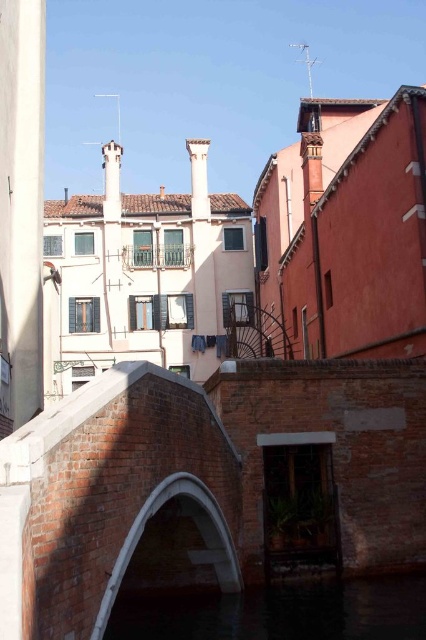
Question: Which of the following is the farthest from the observer?

Choices:
 (A) (160, 492)
 (B) (249, 611)

Answer: (B)

Question: Does dark water at bridge center have a greater width compared to white stone archway at center?

Choices:
 (A) no
 (B) yes

Answer: (B)

Question: Which object appears closest to the camera in this image?

Choices:
 (A) white stone archway at center
 (B) dark water at bridge center

Answer: (A)

Question: Which of the following is the farthest from the observer?

Choices:
 (A) (198, 484)
 (B) (146, 602)

Answer: (B)

Question: Does dark water at bridge center appear on the left side of white stone archway at center?

Choices:
 (A) yes
 (B) no

Answer: (B)

Question: Can you confirm if dark water at bridge center is positioned above white stone archway at center?

Choices:
 (A) yes
 (B) no

Answer: (B)